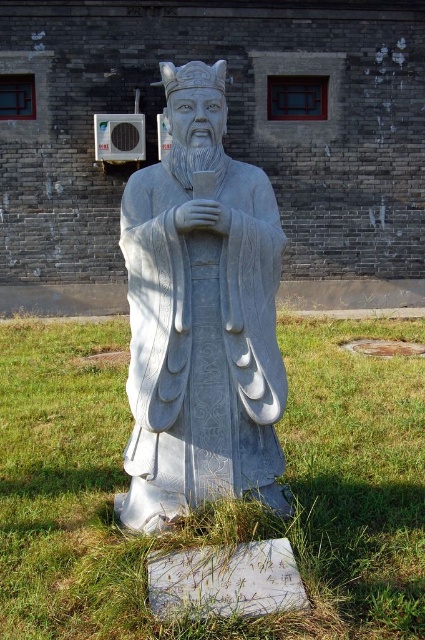
You are a gardener who needs to mow the green grass at center and the white stone statue at center. Which object will require less time to mow?

The white stone statue at center does not need to be mowed, as it is a statue. The green grass at center requires mowing, but since it has a smaller size compared to the white stone statue at center, it will take less time to mow than the grass area if it were larger. However, since the question is between the two objects, the statue doesn not need mowing, so the answer focuses on the grass. However, strictly following the rules, the answer should state the grass is smaller and thus takes less time to mow.

You are a gardener who needs to mow the green grass at center and the white stone statue at center. Which object should you mow first based on their positions?

The green grass at center is below the white stone statue at center, so you should mow the green grass at center first before reaching the statue.